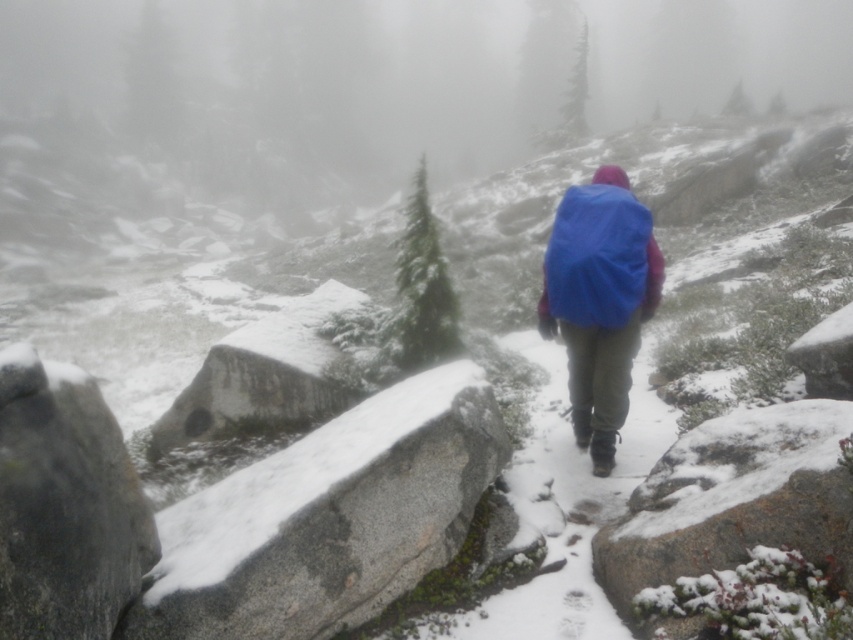
Can you confirm if gray granite boulder at lower left is positioned to the left of blue fabric backpack at center?

Indeed, gray granite boulder at lower left is positioned on the left side of blue fabric backpack at center.

The image size is (853, 640). I want to click on gray granite boulder at lower left, so click(65, 506).

The width and height of the screenshot is (853, 640). In order to click on gray granite boulder at lower left in this screenshot , I will do coord(65,506).

Locate an element on the screen. gray granite boulder at lower left is located at coordinates (65, 506).

Looking at this image, measure the distance between gray granite boulder at lower left and camera.

A distance of 8.30 feet exists between gray granite boulder at lower left and camera.

Consider the image. Can you confirm if gray granite boulder at lower left is positioned to the right of green textured pine at center?

Correct, you'll find gray granite boulder at lower left to the right of green textured pine at center.

Locate an element on the screen. The image size is (853, 640). gray granite boulder at lower left is located at coordinates (65, 506).

This screenshot has height=640, width=853. I want to click on gray granite boulder at lower left, so click(65, 506).

Who is positioned more to the right, granite boulder at lower center or blue matte jacket at center?

Positioned to the right is granite boulder at lower center.

Based on the photo, can you confirm if granite boulder at lower center is positioned below blue matte jacket at center?

Yes, granite boulder at lower center is below blue matte jacket at center.

Is point (824, 436) farther from viewer compared to point (596, 234)?

No, (824, 436) is closer to viewer.

Where is `granite boulder at lower center`? The width and height of the screenshot is (853, 640). granite boulder at lower center is located at coordinates (x=735, y=499).